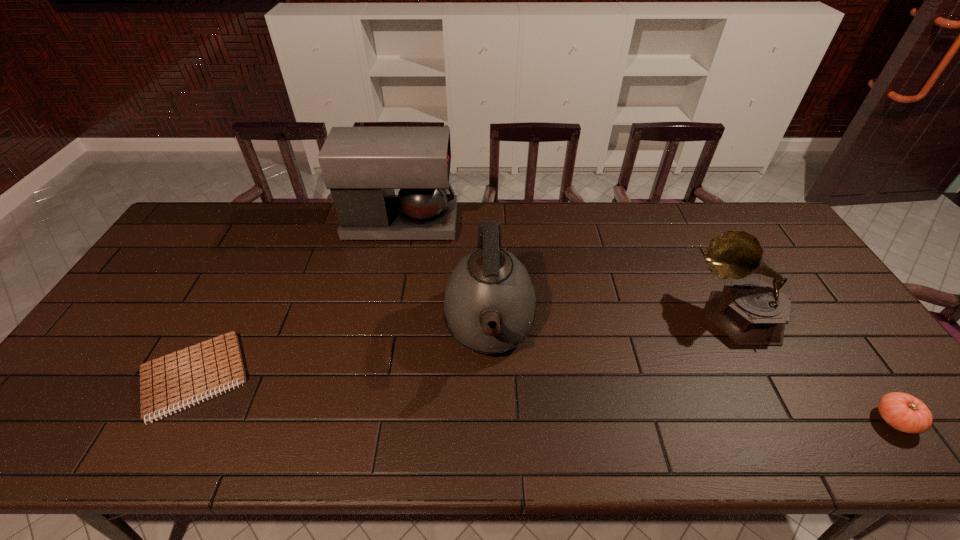
Locate an element on the screen. The image size is (960, 540). free space located on the horn direction of the third tallest object is located at coordinates (x=592, y=313).

You are a GUI agent. You are given a task and a screenshot of the screen. Output one action in this format:
    pyautogui.click(x=<x>, y=<y>)
    Task: Click on the vacant space located on the horn direction of the third tallest object
    
    Given the screenshot: What is the action you would take?
    pyautogui.click(x=553, y=313)

You are a GUI agent. You are given a task and a screenshot of the screen. Output one action in this format:
    pyautogui.click(x=<x>, y=<y>)
    Task: Click on the vacant space situated on the horn direction of the third tallest object
    The width and height of the screenshot is (960, 540).
    Given the screenshot: What is the action you would take?
    pyautogui.click(x=653, y=313)

Where is `vacant space located 0.380m on the left of the rightmost object`? The image size is (960, 540). vacant space located 0.380m on the left of the rightmost object is located at coordinates (708, 420).

Where is `free space located on the left of the notebook`? Image resolution: width=960 pixels, height=540 pixels. free space located on the left of the notebook is located at coordinates (111, 378).

Image resolution: width=960 pixels, height=540 pixels. What are the coordinates of `object that is positioned at the far edge` in the screenshot? It's located at (362, 166).

Locate an element on the screen. tomato that is at the near edge is located at coordinates (903, 412).

Image resolution: width=960 pixels, height=540 pixels. I want to click on notebook that is at the near edge, so pyautogui.click(x=171, y=382).

The width and height of the screenshot is (960, 540). Identify the location of object that is at the right edge. (903, 412).

Where is `object at the near right corner`? The width and height of the screenshot is (960, 540). object at the near right corner is located at coordinates (903, 412).